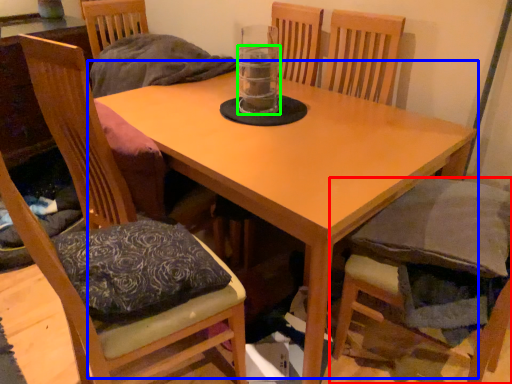
Question: Estimate the real-world distances between objects in this image. Which object is farther from chair (highlighted by a red box), table (highlighted by a blue box) or beverage (highlighted by a green box)?

Choices:
 (A) table
 (B) beverage

Answer: (B)